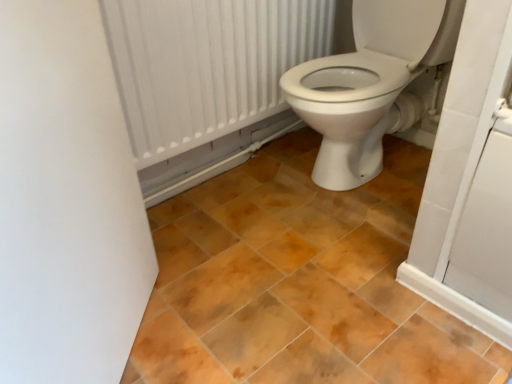
Question: Based on their sizes in the image, would you say brown matte tile at center is bigger or smaller than white textured radiator at upper center?

Choices:
 (A) small
 (B) big

Answer: (B)

Question: Relative to white textured radiator at upper center, is brown matte tile at center in front or behind?

Choices:
 (A) front
 (B) behind

Answer: (A)

Question: From the image's perspective, is brown matte tile at center above or below white textured radiator at upper center?

Choices:
 (A) below
 (B) above

Answer: (A)

Question: Considering the positions of white textured radiator at upper center and brown matte tile at center in the image, is white textured radiator at upper center taller or shorter than brown matte tile at center?

Choices:
 (A) short
 (B) tall

Answer: (B)

Question: From the image's perspective, is white textured radiator at upper center positioned above or below brown matte tile at center?

Choices:
 (A) below
 (B) above

Answer: (B)

Question: Based on their sizes in the image, would you say white textured radiator at upper center is bigger or smaller than brown matte tile at center?

Choices:
 (A) big
 (B) small

Answer: (B)

Question: Considering the positions of point (138, 132) and point (156, 306), is point (138, 132) closer or farther from the camera than point (156, 306)?

Choices:
 (A) farther
 (B) closer

Answer: (A)